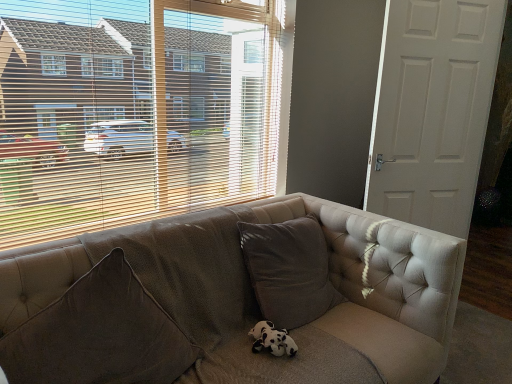
Question: From the image's perspective, relative to tufted fabric couch at center, is brown textured pillow at lower left above or below?

Choices:
 (A) below
 (B) above

Answer: (B)

Question: Is point (128, 281) positioned closer to the camera than point (169, 301)?

Choices:
 (A) farther
 (B) closer

Answer: (B)

Question: Based on their relative distances, which object is nearer to the brown textured pillow at lower left?

Choices:
 (A) tufted fabric couch at center
 (B) black and white plush at center
 (C) wooden blinds at upper left
 (D) white matte door at right

Answer: (A)

Question: Which object is positioned closest to the brown textured pillow at lower left?

Choices:
 (A) tufted fabric couch at center
 (B) black and white plush at center
 (C) wooden blinds at upper left
 (D) white matte door at right

Answer: (A)